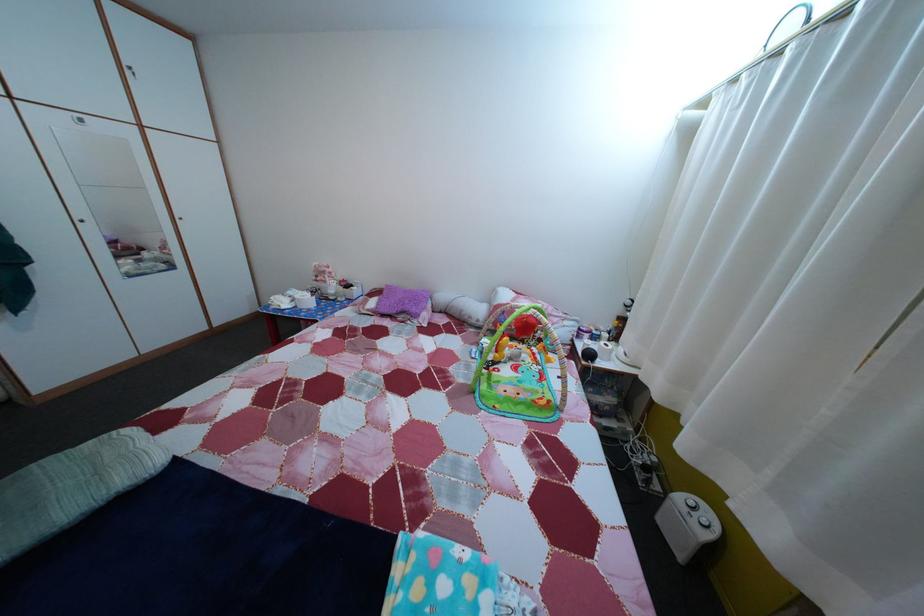
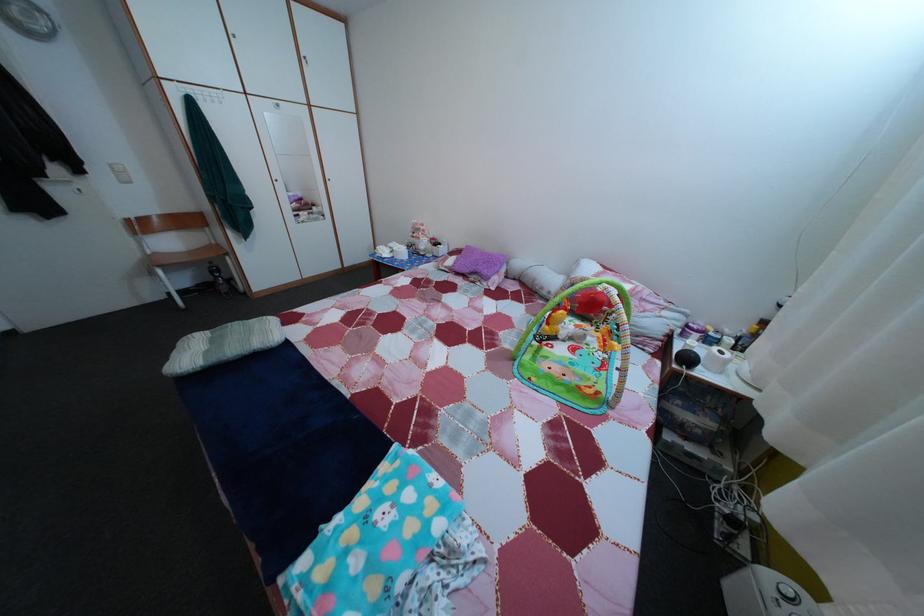
Locate, in the second image, the point that corresponds to point (299, 301) in the first image.

(400, 253)